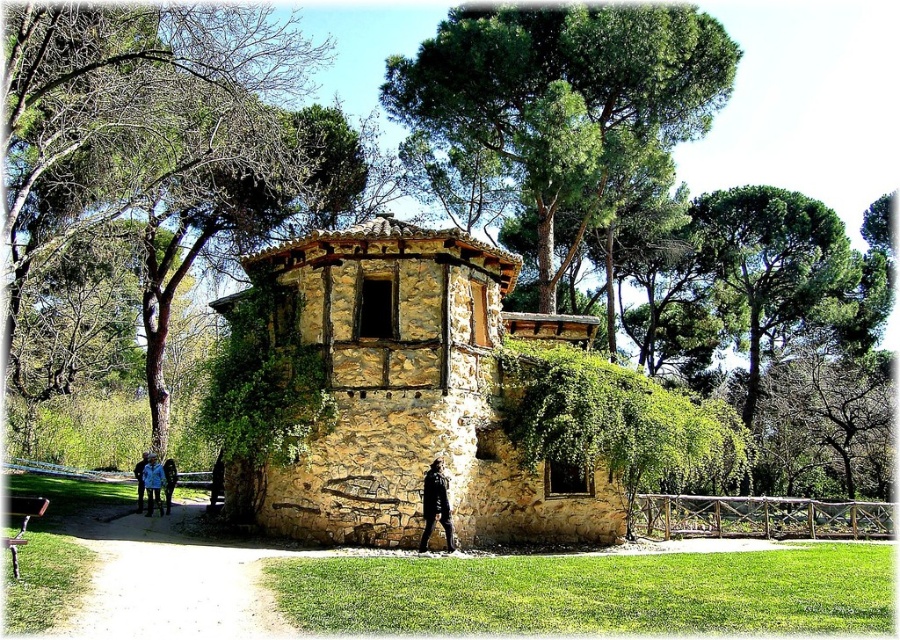
Question: Does brown bark tree at upper left have a smaller size compared to black leather jacket at center?

Choices:
 (A) no
 (B) yes

Answer: (A)

Question: Does black leather jacket at center appear over blue fabric jacket at lower left?

Choices:
 (A) yes
 (B) no

Answer: (A)

Question: Which object appears closest to the camera in this image?

Choices:
 (A) blue fabric jacket at center
 (B) green leafy tree at upper center
 (C) blue fabric jacket at lower left

Answer: (A)

Question: Which is nearer to the blue denim jacket at lower left?

Choices:
 (A) blue fabric jacket at center
 (B) green leafy tree at upper center
 (C) brown bark tree at upper left
 (D) blue fabric jacket at lower left

Answer: (A)

Question: Does green leafy tree at upper center have a lesser width compared to blue denim jacket at lower left?

Choices:
 (A) no
 (B) yes

Answer: (A)

Question: Which of the following is the closest to the observer?

Choices:
 (A) (424, 522)
 (B) (165, 472)
 (C) (78, 84)
 (D) (153, 458)

Answer: (A)